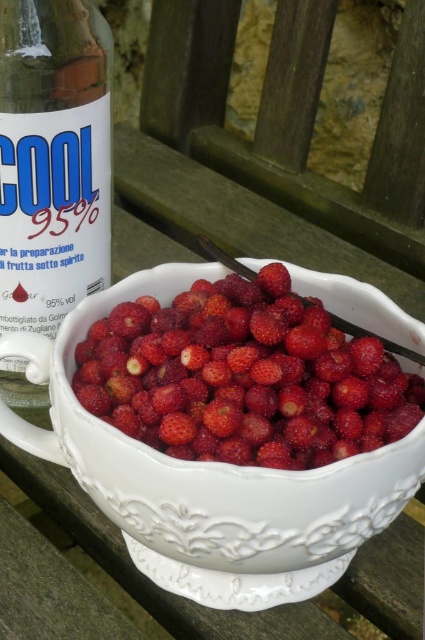
Question: Is white porcelain bowl at center to the right of matte glass bottle at left from the viewer's perspective?

Choices:
 (A) yes
 (B) no

Answer: (A)

Question: Which point is farther from the camera taking this photo?

Choices:
 (A) (102, 33)
 (B) (258, 436)

Answer: (A)

Question: Can you confirm if white porcelain bowl at center is thinner than matte glass bottle at left?

Choices:
 (A) no
 (B) yes

Answer: (A)

Question: Can you confirm if white porcelain bowl at center is positioned above matte glass bottle at left?

Choices:
 (A) yes
 (B) no

Answer: (B)

Question: Based on their relative distances, which object is nearer to the shiny red strawberries at center?

Choices:
 (A) white porcelain bowl at center
 (B) matte glass bottle at left

Answer: (A)

Question: Based on their relative distances, which object is nearer to the white porcelain bowl at center?

Choices:
 (A) matte glass bottle at left
 (B) shiny red strawberries at center

Answer: (B)